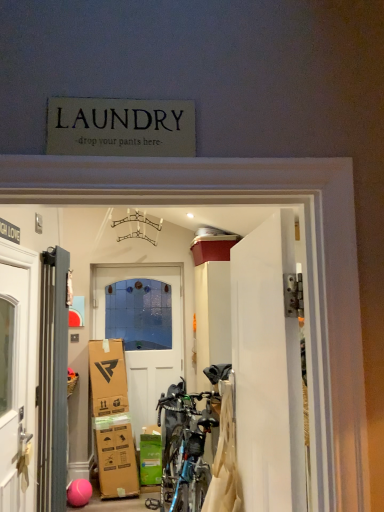
Question: In the image, is metallic gray radiator at left, the 1th door positioned from the left, on the left side or the right side of white wooden door at center, placed as the 2th door when sorted from left to right?

Choices:
 (A) left
 (B) right

Answer: (A)

Question: Considering the positions of metallic gray radiator at left, positioned as the 2th door in back-to-front order, and white wooden door at center, which is the third door from front to back, in the image, is metallic gray radiator at left, positioned as the 2th door in back-to-front order, wider or thinner than white wooden door at center, which is the third door from front to back,?

Choices:
 (A) wide
 (B) thin

Answer: (A)

Question: Which object is the farthest from the white wooden door at center, placed as the 2th door when sorted from left to right?

Choices:
 (A) green cardboard box at lower center
 (B) white glossy door at center, placed as the 3th door when sorted from left to right
 (C) metallic gray radiator at left, positioned as the 2th door in back-to-front order

Answer: (B)

Question: Estimate the real-world distances between objects in this image. Which object is farther from the metallic gray radiator at left, the third door when ordered from right to left?

Choices:
 (A) white wooden door at center, acting as the 2th door starting from the right
 (B) green cardboard box at lower center
 (C) white glossy door at center, placed as the 3th door when sorted from left to right

Answer: (A)